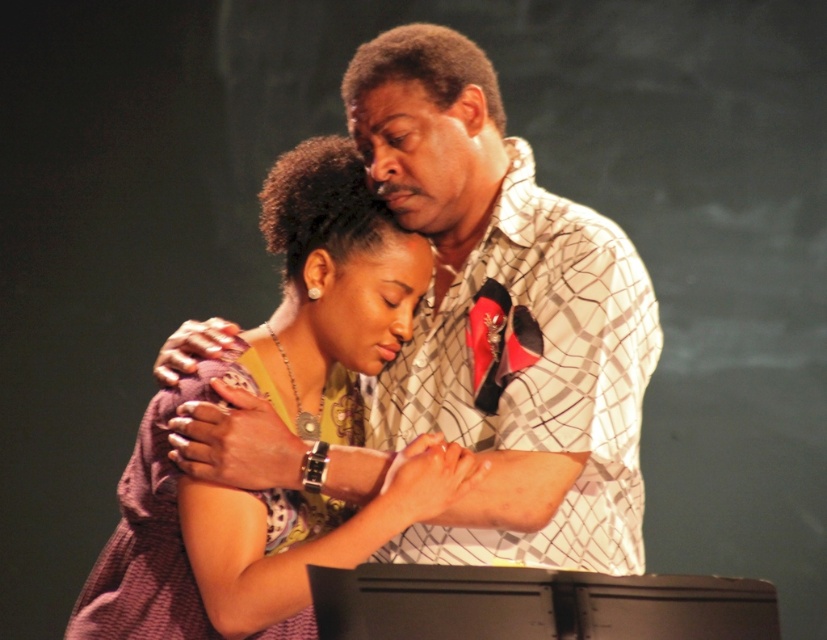
Question: Is white checkered shirt at upper center below purple fabric dress at center?

Choices:
 (A) yes
 (B) no

Answer: (B)

Question: Which object is closer to the camera taking this photo?

Choices:
 (A) white checkered shirt at upper center
 (B) purple fabric dress at center

Answer: (B)

Question: Is white checkered shirt at upper center smaller than purple fabric dress at center?

Choices:
 (A) yes
 (B) no

Answer: (B)

Question: Is white checkered shirt at upper center smaller than purple fabric dress at center?

Choices:
 (A) yes
 (B) no

Answer: (B)